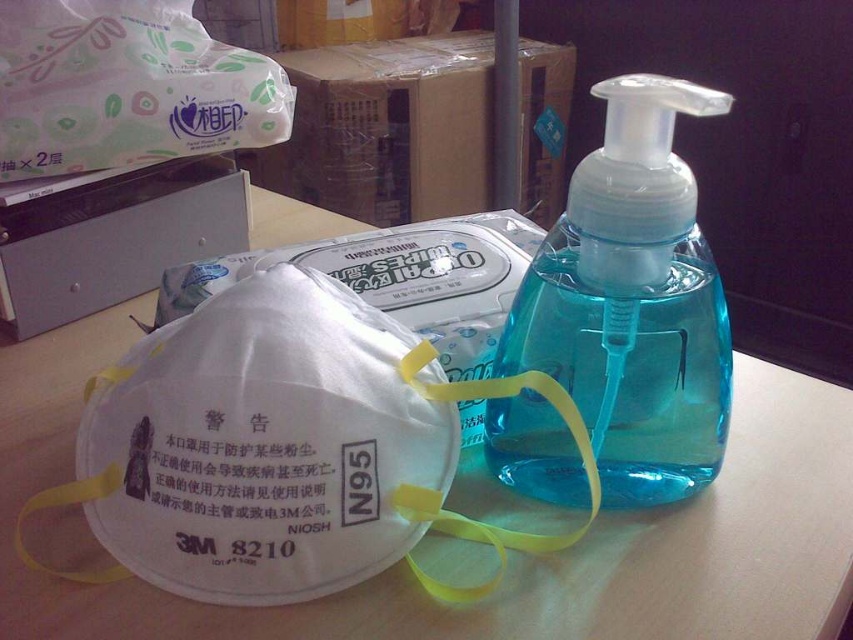
Question: Does white plastic mask at center have a smaller size compared to blue translucent plastic bottle at center?

Choices:
 (A) yes
 (B) no

Answer: (B)

Question: Where is white plastic mask at center located in relation to blue translucent plastic bottle at center in the image?

Choices:
 (A) left
 (B) right

Answer: (A)

Question: Which of the following is the farthest from the observer?

Choices:
 (A) (367, 580)
 (B) (663, 397)

Answer: (B)

Question: Is white plastic mask at center positioned at the back of blue translucent plastic bottle at center?

Choices:
 (A) yes
 (B) no

Answer: (A)

Question: Which object is farther from the camera taking this photo?

Choices:
 (A) white plastic mask at center
 (B) blue translucent plastic bottle at center

Answer: (A)